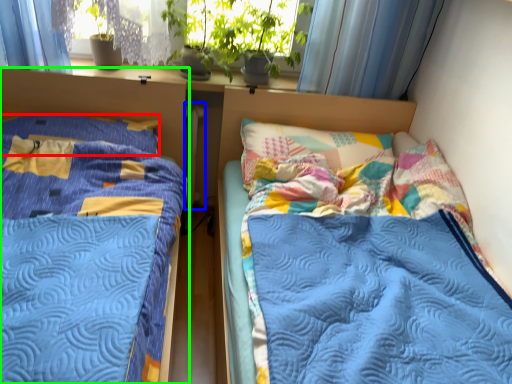
Question: Estimate the real-world distances between objects in this image. Which object is farther from pillow (highlighted by a red box), radiator (highlighted by a blue box) or bed (highlighted by a green box)?

Choices:
 (A) radiator
 (B) bed

Answer: (A)